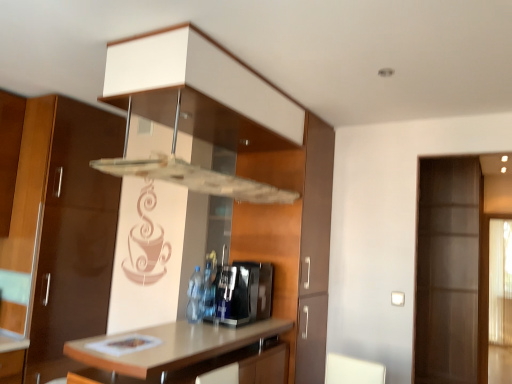
The height and width of the screenshot is (384, 512). What do you see at coordinates (243, 293) in the screenshot?
I see `sleek metallic coffee machine at center` at bounding box center [243, 293].

What is the approximate width of sleek metallic coffee machine at center?

sleek metallic coffee machine at center is 19.75 inches in width.

This screenshot has height=384, width=512. Describe the element at coordinates (170, 346) in the screenshot. I see `light brown laminate countertop at center` at that location.

Measure the distance between point [467,274] and camera.

The depth of point [467,274] is 12.00 feet.

In order to face transparent glass door at right, should I rotate leftwards or rightwards?

You should rotate right by 23.951 degrees.

What do you see at coordinates (195, 297) in the screenshot? I see `translucent plastic bottle at center` at bounding box center [195, 297].

Image resolution: width=512 pixels, height=384 pixels. I want to click on sleek metallic coffee machine at center, so click(x=243, y=293).

Would you consider light brown laminate countertop at center to be distant from translucent plastic bottle at center?

No.

Is light brown laminate countertop at center thinner than translucent plastic bottle at center?

No, light brown laminate countertop at center is not thinner than translucent plastic bottle at center.

From a real-world perspective, is light brown laminate countertop at center positioned under translucent plastic bottle at center based on gravity?

Yes.

Identify the location of screen door on the right of sleek metallic coffee machine at center. This screenshot has width=512, height=384. (448, 270).

Which is closer, (267, 269) or (432, 337)?

The point (267, 269) is closer.

In terms of width, does sleek metallic coffee machine at center look wider or thinner when compared to transparent glass door at right?

In the image, sleek metallic coffee machine at center appears to be more narrow than transparent glass door at right.

Visually, is sleek metallic coffee machine at center positioned to the left or to the right of transparent glass door at right?

From the image, it's evident that sleek metallic coffee machine at center is to the left of transparent glass door at right.

Looking at this image, considering the relative sizes of translucent plastic bottle at center and transparent glass door at right in the image provided, is translucent plastic bottle at center bigger than transparent glass door at right?

No.

Which object is further away from the camera, translucent plastic bottle at center or transparent glass door at right?

transparent glass door at right is more distant.

From a real-world perspective, is translucent plastic bottle at center above or below transparent glass door at right?

In terms of real-world spatial position, translucent plastic bottle at center is below transparent glass door at right.

Which is in front, point (200, 317) or point (478, 217)?

The point (200, 317) is closer to the camera.

Can you confirm if sleek metallic coffee machine at center is thinner than translucent plastic bottle at center?

Incorrect, the width of sleek metallic coffee machine at center is not less than that of translucent plastic bottle at center.

Does sleek metallic coffee machine at center turn towards translucent plastic bottle at center?

Yes, sleek metallic coffee machine at center is facing translucent plastic bottle at center.

Which is behind, point (205, 318) or point (194, 304)?

Point (205, 318)

Is sleek metallic coffee machine at center smaller than translucent plastic bottle at center?

Actually, sleek metallic coffee machine at center might be larger than translucent plastic bottle at center.

Is translucent plastic bottle at center smaller than light brown laminate countertop at center?

Result: Indeed, translucent plastic bottle at center has a smaller size compared to light brown laminate countertop at center.

Is translucent plastic bottle at center at the right side of light brown laminate countertop at center?

Incorrect, translucent plastic bottle at center is not on the right side of light brown laminate countertop at center.

Do you think translucent plastic bottle at center is within light brown laminate countertop at center, or outside of it?

translucent plastic bottle at center is spatially situated outside light brown laminate countertop at center.

How distant is translucent plastic bottle at center from light brown laminate countertop at center?

The distance of translucent plastic bottle at center from light brown laminate countertop at center is 39.75 centimeters.

Considering the sizes of transparent glass door at right and light brown laminate countertop at center in the image, is transparent glass door at right bigger or smaller than light brown laminate countertop at center?

In the image, transparent glass door at right appears to be larger than light brown laminate countertop at center.

Is transparent glass door at right in front of light brown laminate countertop at center?

No, transparent glass door at right is further to the viewer.

Is transparent glass door at right to the right of light brown laminate countertop at center from the viewer's perspective?

Yes, transparent glass door at right is to the right of light brown laminate countertop at center.

Where is `countertop in front of the sleek metallic coffee machine at center`? Image resolution: width=512 pixels, height=384 pixels. countertop in front of the sleek metallic coffee machine at center is located at coordinates (170, 346).

Relative to sleek metallic coffee machine at center, is light brown laminate countertop at center in front or behind?

light brown laminate countertop at center is positioned closer to the viewer than sleek metallic coffee machine at center.

Is light brown laminate countertop at center spatially inside sleek metallic coffee machine at center, or outside of it?

light brown laminate countertop at center is spatially situated outside sleek metallic coffee machine at center.

Consider the image. Which object is thinner, light brown laminate countertop at center or sleek metallic coffee machine at center?

sleek metallic coffee machine at center.

Identify the location of bottle above the light brown laminate countertop at center (from the image's perspective). The image size is (512, 384). [x=195, y=297].

Identify the location of screen door that appears behind the sleek metallic coffee machine at center. This screenshot has width=512, height=384. (448, 270).

When comparing their distances from light brown laminate countertop at center, does sleek metallic coffee machine at center or translucent plastic bottle at center seem closer?

Based on the image, sleek metallic coffee machine at center appears to be nearer to light brown laminate countertop at center.

When comparing their distances from light brown laminate countertop at center, does transparent glass door at right or sleek metallic coffee machine at center seem further?

transparent glass door at right is further to light brown laminate countertop at center.

Which object lies nearer to the anchor point light brown laminate countertop at center, transparent glass door at right or translucent plastic bottle at center?

Based on the image, translucent plastic bottle at center appears to be nearer to light brown laminate countertop at center.

Based on their spatial positions, is transparent glass door at right or light brown laminate countertop at center further from sleek metallic coffee machine at center?

The object further to sleek metallic coffee machine at center is transparent glass door at right.

Which object lies nearer to the anchor point transparent glass door at right, sleek metallic coffee machine at center or translucent plastic bottle at center?

Based on the image, sleek metallic coffee machine at center appears to be nearer to transparent glass door at right.

Considering their positions, is translucent plastic bottle at center positioned closer to light brown laminate countertop at center than transparent glass door at right?

Among the two, translucent plastic bottle at center is located nearer to light brown laminate countertop at center.

Considering their positions, is sleek metallic coffee machine at center positioned closer to transparent glass door at right than light brown laminate countertop at center?

sleek metallic coffee machine at center is positioned closer to the anchor transparent glass door at right.

From the image, which object appears to be nearer to transparent glass door at right, light brown laminate countertop at center or sleek metallic coffee machine at center?

sleek metallic coffee machine at center lies closer to transparent glass door at right than the other object.

Locate an element on the screen. This screenshot has width=512, height=384. appliance located between light brown laminate countertop at center and transparent glass door at right in the left-right direction is located at coordinates (243, 293).

The image size is (512, 384). Find the location of `countertop situated between translucent plastic bottle at center and transparent glass door at right from left to right`. countertop situated between translucent plastic bottle at center and transparent glass door at right from left to right is located at coordinates [170, 346].

In order to click on appliance located between translucent plastic bottle at center and transparent glass door at right in the left-right direction in this screenshot , I will do click(x=243, y=293).

Where is `appliance positioned between light brown laminate countertop at center and translucent plastic bottle at center from near to far`? This screenshot has width=512, height=384. appliance positioned between light brown laminate countertop at center and translucent plastic bottle at center from near to far is located at coordinates (243, 293).